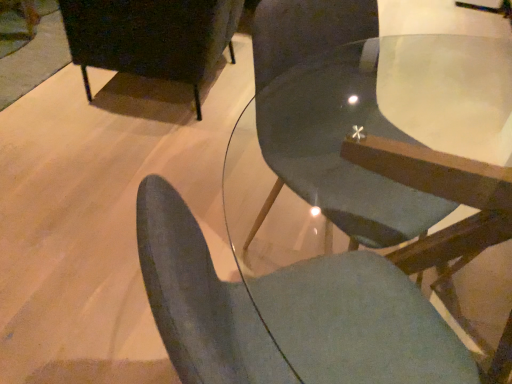
Where is `vacant space to the left of matte gray chair at center, which is the second chair from back to front`? The image size is (512, 384). vacant space to the left of matte gray chair at center, which is the second chair from back to front is located at coordinates (203, 234).